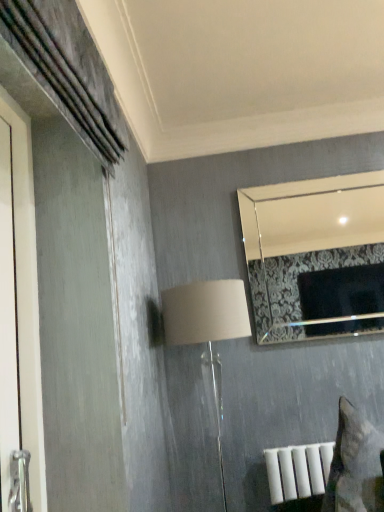
Identify the location of silver metallic mirror at upper right. This screenshot has width=384, height=512. (319, 263).

The image size is (384, 512). What do you see at coordinates (319, 263) in the screenshot? I see `silver metallic mirror at upper right` at bounding box center [319, 263].

The image size is (384, 512). What do you see at coordinates (206, 323) in the screenshot?
I see `beige fabric lampshade at center` at bounding box center [206, 323].

This screenshot has width=384, height=512. Identify the location of beige fabric lampshade at center. 206,323.

In order to click on silver metallic mirror at upper right in this screenshot , I will do `click(319, 263)`.

Would you say beige fabric lampshade at center is to the left or to the right of silver metallic mirror at upper right in the picture?

beige fabric lampshade at center is to the left of silver metallic mirror at upper right.

Considering their positions, is beige fabric lampshade at center located in front of or behind silver metallic mirror at upper right?

beige fabric lampshade at center is in front of silver metallic mirror at upper right.

Is point (227, 325) positioned behind point (297, 305)?

That is False.

From the image's perspective, is beige fabric lampshade at center located beneath silver metallic mirror at upper right?

Yes.

Based on the photo, from a real-world perspective, is beige fabric lampshade at center physically above silver metallic mirror at upper right?

No, from a real-world perspective, beige fabric lampshade at center is not on top of silver metallic mirror at upper right.

Considering the sizes of objects beige fabric lampshade at center and silver metallic mirror at upper right in the image provided, who is wider, beige fabric lampshade at center or silver metallic mirror at upper right?

With larger width is beige fabric lampshade at center.

Can you confirm if beige fabric lampshade at center is shorter than silver metallic mirror at upper right?

No.

Does beige fabric lampshade at center have a smaller size compared to silver metallic mirror at upper right?

Actually, beige fabric lampshade at center might be larger than silver metallic mirror at upper right.

Does beige fabric lampshade at center contain silver metallic mirror at upper right?

No, silver metallic mirror at upper right is not a part of beige fabric lampshade at center.

Is beige fabric lampshade at center not close to silver metallic mirror at upper right?

Indeed, beige fabric lampshade at center is not near silver metallic mirror at upper right.

Is beige fabric lampshade at center looking in the opposite direction of silver metallic mirror at upper right?

beige fabric lampshade at center is not turned away from silver metallic mirror at upper right.

How many degrees apart are the facing directions of beige fabric lampshade at center and silver metallic mirror at upper right?

The facing directions of beige fabric lampshade at center and silver metallic mirror at upper right are 0.00222 degrees apart.

Where is `mirror behind the beige fabric lampshade at center`? This screenshot has height=512, width=384. mirror behind the beige fabric lampshade at center is located at coordinates (319, 263).

Visually, is silver metallic mirror at upper right positioned to the left or to the right of beige fabric lampshade at center?

From the image, it's evident that silver metallic mirror at upper right is to the right of beige fabric lampshade at center.

In the image, is silver metallic mirror at upper right positioned in front of or behind beige fabric lampshade at center?

Visually, silver metallic mirror at upper right is located behind beige fabric lampshade at center.

Is point (286, 199) more distant than point (180, 291)?

Yes, it is.

From the image's perspective, who appears lower, silver metallic mirror at upper right or beige fabric lampshade at center?

beige fabric lampshade at center.

From a real-world perspective, is silver metallic mirror at upper right located beneath beige fabric lampshade at center?

No, from a real-world perspective, silver metallic mirror at upper right is not below beige fabric lampshade at center.

Is silver metallic mirror at upper right wider than beige fabric lampshade at center?

Incorrect, the width of silver metallic mirror at upper right does not surpass that of beige fabric lampshade at center.

Considering the sizes of objects silver metallic mirror at upper right and beige fabric lampshade at center in the image provided, who is shorter, silver metallic mirror at upper right or beige fabric lampshade at center?

silver metallic mirror at upper right is shorter.

Considering the sizes of objects silver metallic mirror at upper right and beige fabric lampshade at center in the image provided, who is bigger, silver metallic mirror at upper right or beige fabric lampshade at center?

beige fabric lampshade at center is bigger.

Would you say beige fabric lampshade at center is part of silver metallic mirror at upper right's contents?

Definitely not — beige fabric lampshade at center is not inside silver metallic mirror at upper right.

Are silver metallic mirror at upper right and beige fabric lampshade at center beside each other?

No, silver metallic mirror at upper right is not with beige fabric lampshade at center.

Is silver metallic mirror at upper right facing towards beige fabric lampshade at center?

No, silver metallic mirror at upper right does not turn towards beige fabric lampshade at center.

How distant is silver metallic mirror at upper right from beige fabric lampshade at center?

silver metallic mirror at upper right is 2.31 meters away from beige fabric lampshade at center.

The width and height of the screenshot is (384, 512). I want to click on mirror that is on the right side of beige fabric lampshade at center, so click(319, 263).

Find the location of `mirror above the beige fabric lampshade at center (from a real-world perspective)`. mirror above the beige fabric lampshade at center (from a real-world perspective) is located at coordinates (319, 263).

Identify the location of mirror above the beige fabric lampshade at center (from the image's perspective). click(x=319, y=263).